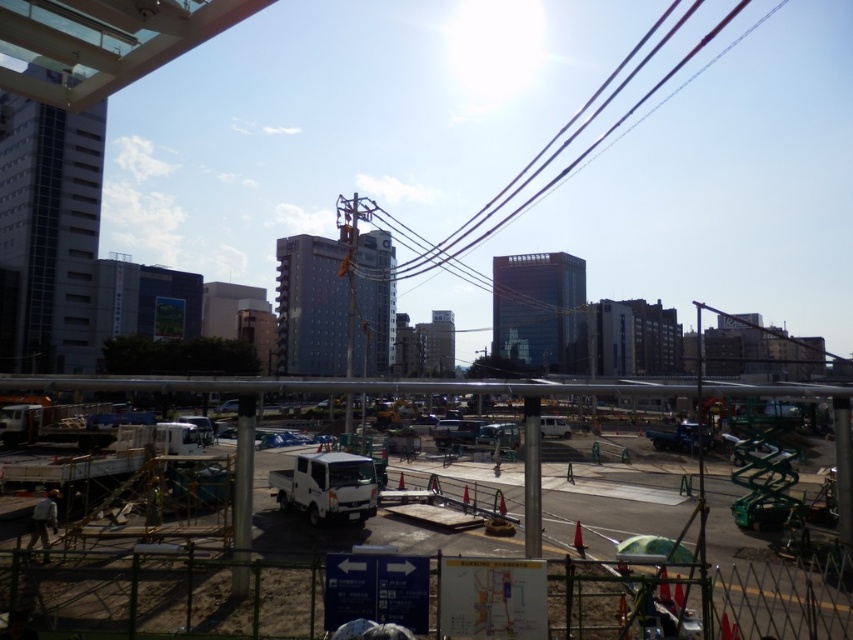
Who is lower down, white matte truck at center or black wire at upper center?

Positioned lower is white matte truck at center.

Between white matte truck at center and black wire at upper center, which one appears on the left side from the viewer's perspective?

Positioned to the left is white matte truck at center.

Between point (848, 422) and point (751, 22), which one is positioned behind?

Positioned behind is point (751, 22).

Locate an element on the screen. This screenshot has width=853, height=640. white matte truck at center is located at coordinates (469, 392).